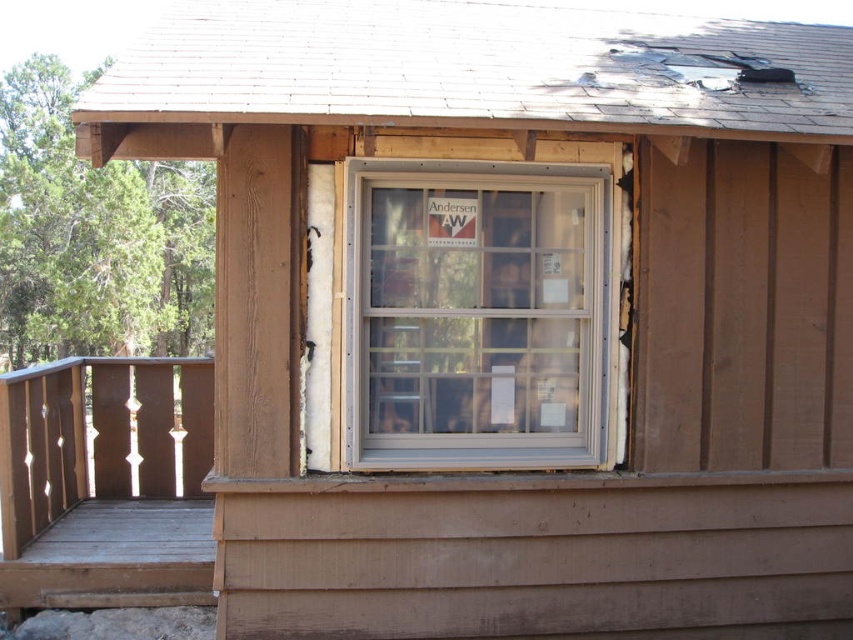
From the picture: You are standing in front of a wooden cabin with a window under renovation. You need to locate the white plastic window at center. What are its coordinates?

The white plastic window at center is located at coordinates point (474,314).

You are standing in front of the wooden cabin and want to inspect the white plastic window at center and the wooden porch at lower left. Which object will appear larger in your field of view?

The white plastic window at center will appear larger in your field of view because it is closer to you than the wooden porch at lower left.